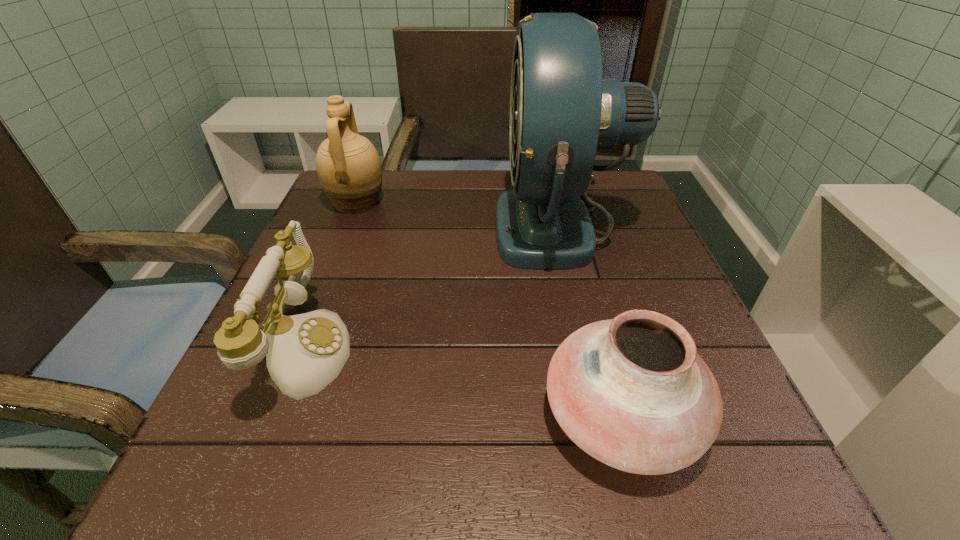
Where is `free space at the far edge of the desktop`? The image size is (960, 540). free space at the far edge of the desktop is located at coordinates (422, 202).

This screenshot has height=540, width=960. In the image, there is a desktop. What are the coordinates of `vacant area at the near edge` in the screenshot? It's located at (489, 477).

Find the location of a particular element. The height and width of the screenshot is (540, 960). free region at the left edge of the desktop is located at coordinates click(351, 265).

Where is `vacant space at the right edge`? This screenshot has width=960, height=540. vacant space at the right edge is located at coordinates (678, 312).

Find the location of a particular element. vacant region at the near right corner is located at coordinates (756, 472).

At what (x,y) coordinates should I click in order to perform the action: click on unoccupied area between the pottery and the telephone. Please return your answer as a coordinate pair (x, y). This screenshot has height=540, width=960. Looking at the image, I should click on (463, 382).

This screenshot has height=540, width=960. Find the location of `free space between the pitcher and the telephone`. free space between the pitcher and the telephone is located at coordinates (331, 275).

You are a GUI agent. You are given a task and a screenshot of the screen. Output one action in this format:
    pyautogui.click(x=<x>, y=<y>)
    Task: Click on the empty space between the telephone and the fan
    The height and width of the screenshot is (540, 960).
    Given the screenshot: What is the action you would take?
    pyautogui.click(x=433, y=287)

Locate an element on the screen. The image size is (960, 540). vacant area that lies between the telephone and the pitcher is located at coordinates (331, 275).

Identify the location of vacant point located between the pottery and the tallest object. This screenshot has height=540, width=960. (591, 321).